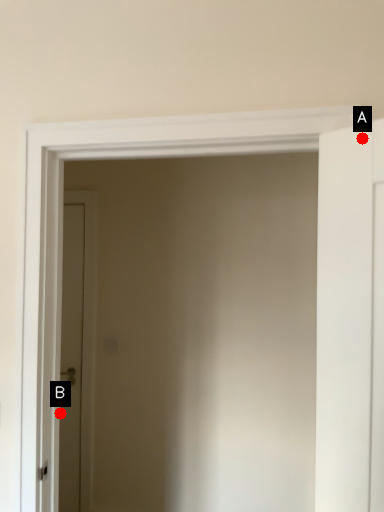
Question: Two points are circled on the image, labeled by A and B beside each circle. Which of the following is the closest to the observer?

Choices:
 (A) A is closer
 (B) B is closer

Answer: (A)